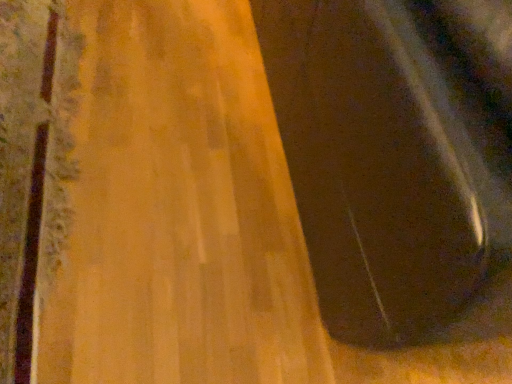
The width and height of the screenshot is (512, 384). Find the location of `black glossy phone at right`. black glossy phone at right is located at coordinates (368, 175).

The width and height of the screenshot is (512, 384). Describe the element at coordinates (368, 175) in the screenshot. I see `black glossy phone at right` at that location.

In order to face black glossy phone at right, should I rotate leftwards or rightwards?

A 29.707 degree turn to the right will do.

Find the location of a particular element. Image resolution: width=512 pixels, height=384 pixels. black glossy phone at right is located at coordinates (368, 175).